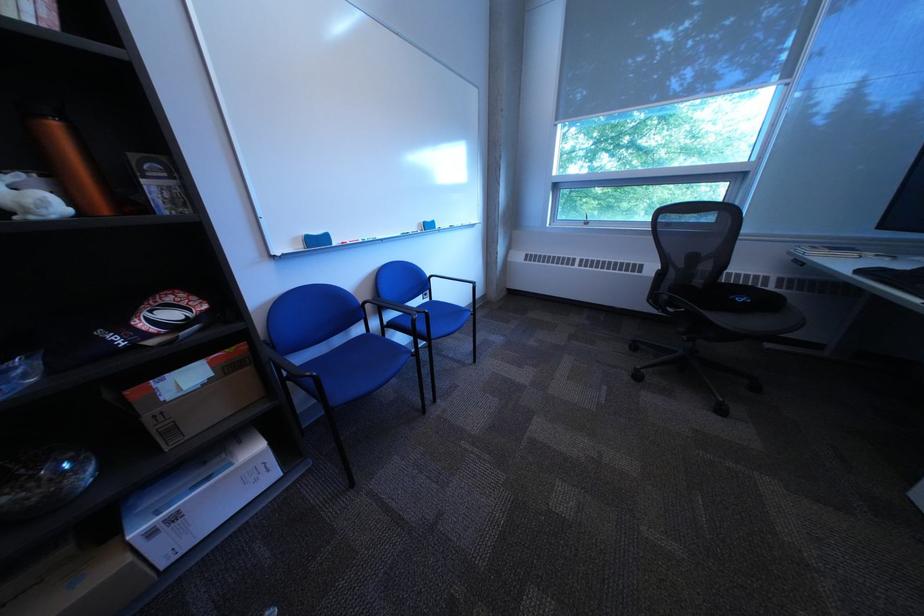
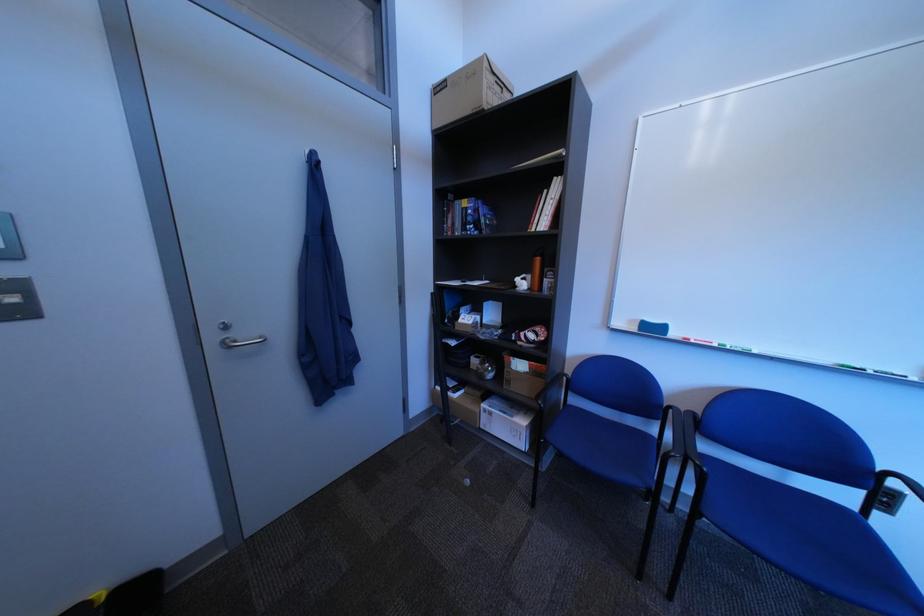
Locate, in the second image, the point that corresponds to (x=310, y=241) in the first image.

(647, 323)